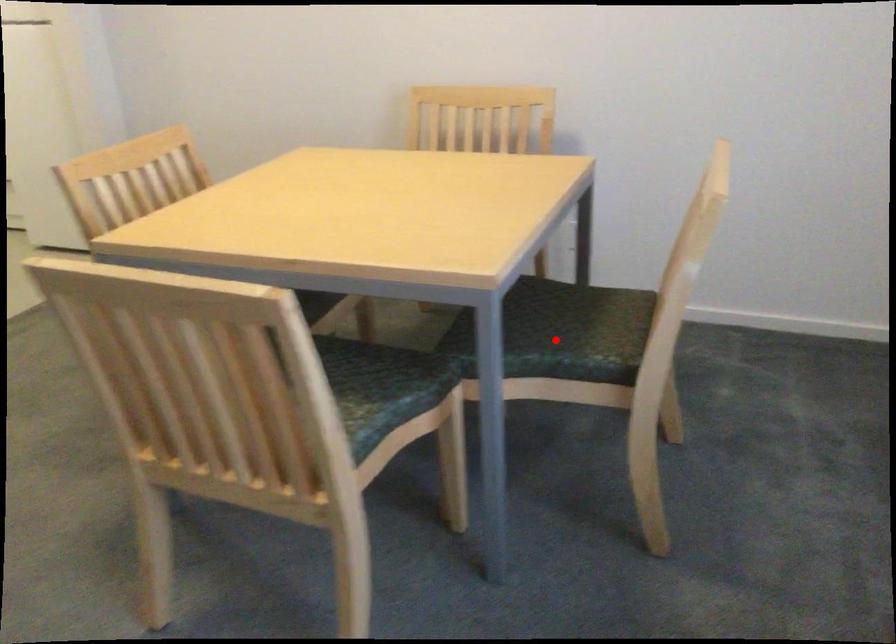
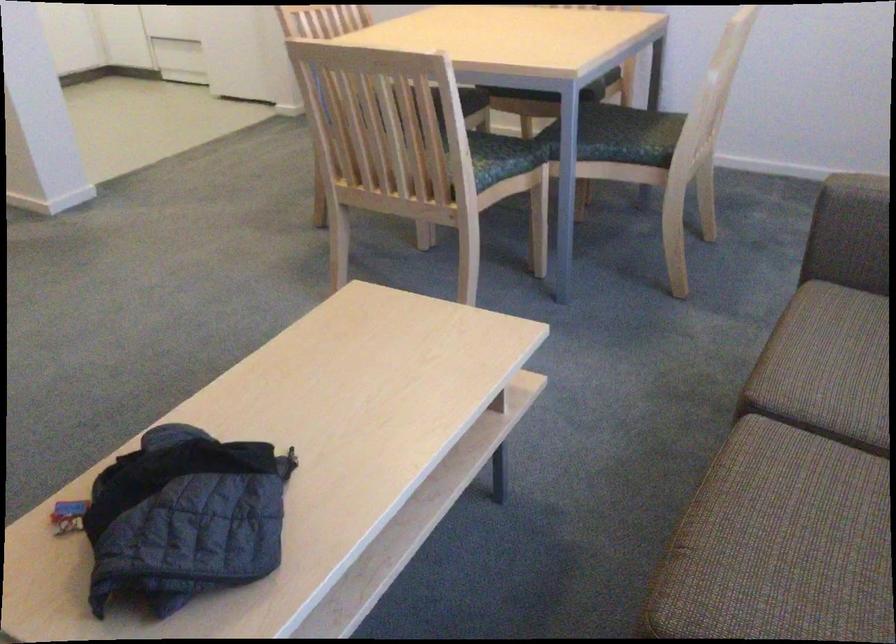
In the second image, find the point that corresponds to the highlighted location in the first image.

(619, 135)